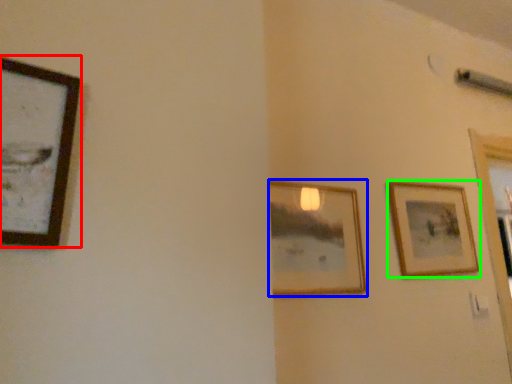
Question: Considering the real-world distances, which object is closest to picture frame (highlighted by a red box)? picture frame (highlighted by a blue box) or picture frame (highlighted by a green box).

Choices:
 (A) picture frame
 (B) picture frame

Answer: (A)